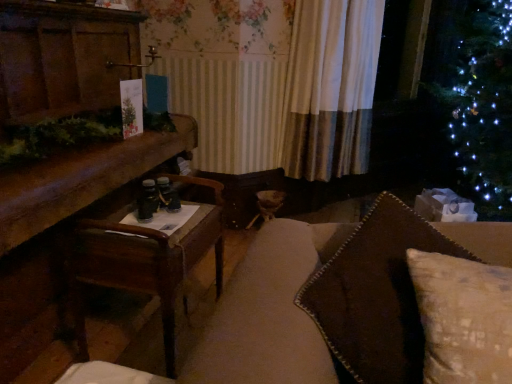
Question: Is wooden table at left directly adjacent to brown textured pillow at right?

Choices:
 (A) no
 (B) yes

Answer: (A)

Question: Can you confirm if wooden table at left is bigger than brown textured pillow at right?

Choices:
 (A) yes
 (B) no

Answer: (A)

Question: Considering the relative sizes of wooden table at left and brown textured pillow at right in the image provided, is wooden table at left smaller than brown textured pillow at right?

Choices:
 (A) yes
 (B) no

Answer: (B)

Question: Does wooden table at left have a greater height compared to brown textured pillow at right?

Choices:
 (A) yes
 (B) no

Answer: (A)

Question: Does wooden table at left have a lesser height compared to brown textured pillow at right?

Choices:
 (A) yes
 (B) no

Answer: (B)

Question: Would you say wooden table at left is inside or outside wooden table at left?

Choices:
 (A) inside
 (B) outside

Answer: (A)

Question: From the image's perspective, is wooden table at left above or below wooden table at left?

Choices:
 (A) below
 (B) above

Answer: (A)

Question: Is point (200, 256) closer or farther from the camera than point (44, 327)?

Choices:
 (A) farther
 (B) closer

Answer: (B)

Question: Considering their positions, is wooden table at left located in front of or behind wooden table at left?

Choices:
 (A) behind
 (B) front

Answer: (A)

Question: From the image's perspective, is white textured curtain at center located above or below brown textured pillow at right?

Choices:
 (A) above
 (B) below

Answer: (A)

Question: Considering the positions of white textured curtain at center and brown textured pillow at right in the image, is white textured curtain at center wider or thinner than brown textured pillow at right?

Choices:
 (A) wide
 (B) thin

Answer: (B)

Question: Considering the positions of point (307, 178) and point (476, 299), is point (307, 178) closer or farther from the camera than point (476, 299)?

Choices:
 (A) farther
 (B) closer

Answer: (A)

Question: Considering their positions, is white textured curtain at center located in front of or behind brown textured pillow at right?

Choices:
 (A) front
 (B) behind

Answer: (B)

Question: Relative to wooden table at left, is wooden table at left in front or behind?

Choices:
 (A) behind
 (B) front

Answer: (B)

Question: In terms of size, does wooden table at left appear bigger or smaller than wooden table at left?

Choices:
 (A) small
 (B) big

Answer: (B)